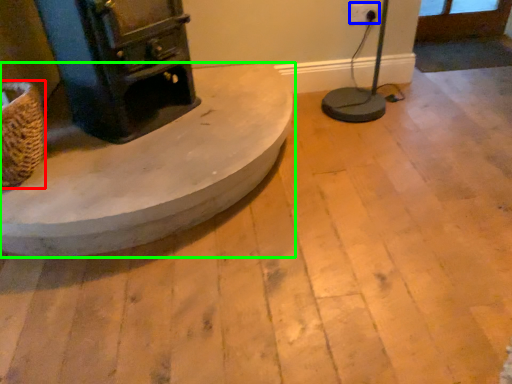
Question: Based on their relative distances, which object is nearer to basket (highlighted by a red box)? Choose from electric outlet (highlighted by a blue box) and furniture (highlighted by a green box).

Choices:
 (A) electric outlet
 (B) furniture

Answer: (B)